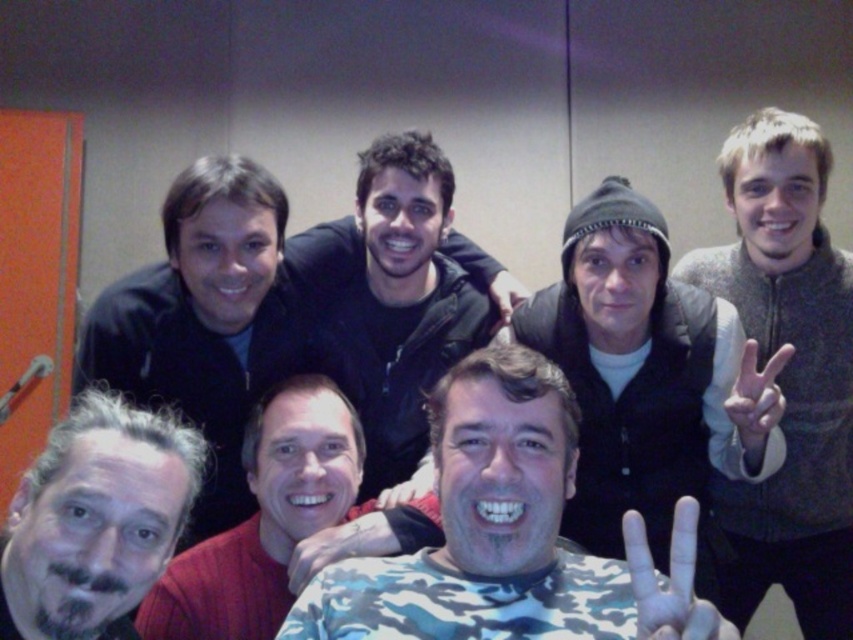
You are standing in the room where the photo was taken and want to move from the point at the bottom center to the orange door on the left. There are two points marked in the image, point at point (373, 202) and point at (409, 515). Which point should you avoid stepping on to ensure you can reach the door without obstruction?

You should avoid stepping on point (373, 202) because it is behind point (409, 515) and might block your path to the orange door on the left.

You are standing at the camera position and see two points in the image. Which point is closer to you, point (689,609) or point (770,388)?

Point (689,609) is in front of point (770,388), so it is closer to you.